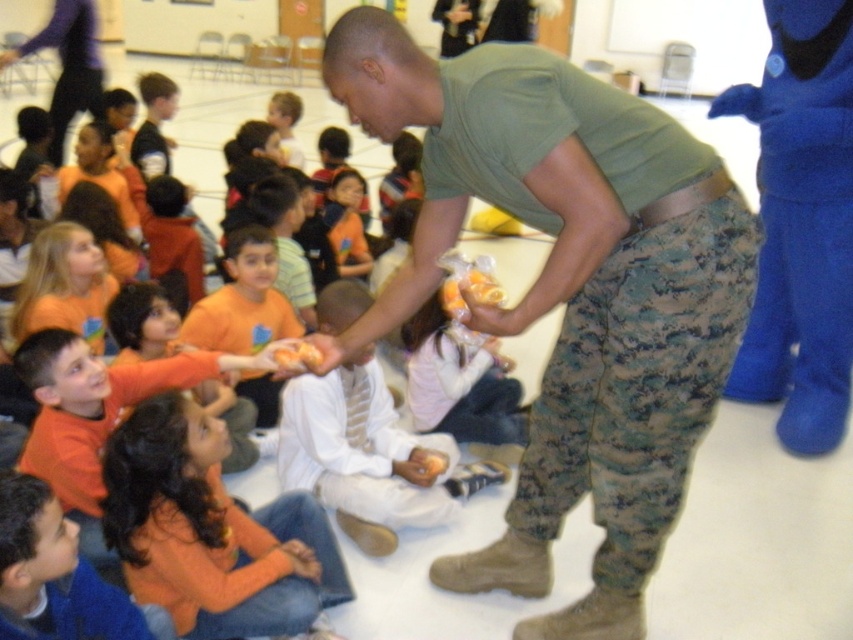
You are a photographer trying to capture a closeup shot of the orange cotton shirt at lower left and the orange shirt at upper left. Since you want to focus on the details of the shirts, which one should you zoom in on to ensure it fills more of the frame?

The orange cotton shirt at lower left should be zoomed in on because its width is larger than the orange shirt at upper left, making it better suited for a closeup to fill the frame.